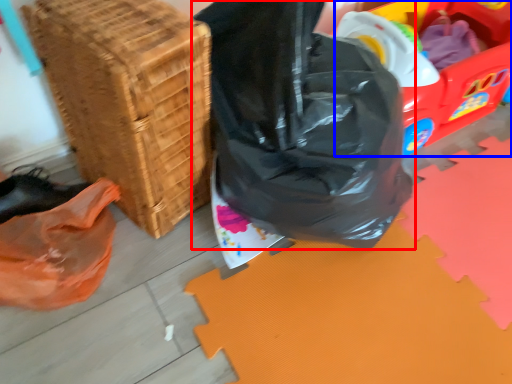
Question: Which point is closer to the camera, plastic bag (highlighted by a red box) or wagon (highlighted by a blue box)?

Choices:
 (A) plastic bag
 (B) wagon

Answer: (A)